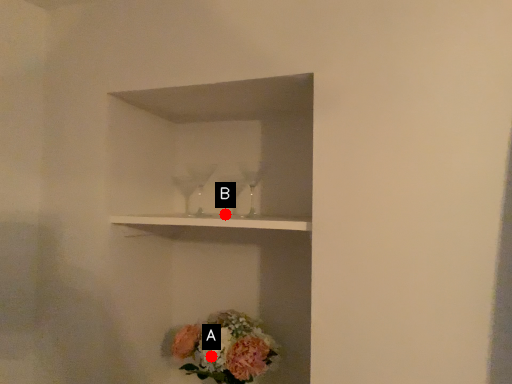
Question: Two points are circled on the image, labeled by A and B beside each circle. Which point appears farthest from the camera in this image?

Choices:
 (A) A is further
 (B) B is further

Answer: (B)